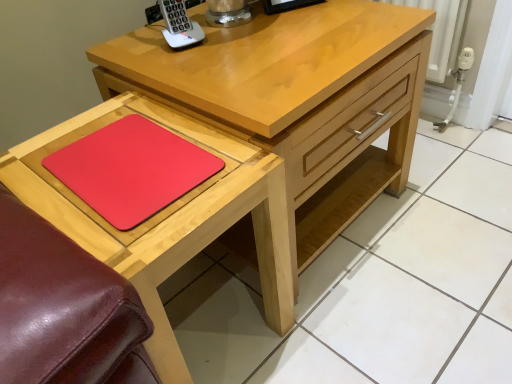
Question: Is rubberized red mousepad at lower left inside or outside of matte wood chest of drawers at center?

Choices:
 (A) inside
 (B) outside

Answer: (B)

Question: Considering the positions of rubberized red mousepad at lower left and matte wood chest of drawers at center in the image, is rubberized red mousepad at lower left wider or thinner than matte wood chest of drawers at center?

Choices:
 (A) wide
 (B) thin

Answer: (B)

Question: Which object is positioned closest to the matte wood chest of drawers at center?

Choices:
 (A) matte wooden table at lower left
 (B) rubberized red mousepad at lower left
 (C) white plastic phone at upper center

Answer: (A)

Question: Estimate the real-world distances between objects in this image. Which object is closer to the white plastic phone at upper center?

Choices:
 (A) rubberized red mousepad at lower left
 (B) matte wood chest of drawers at center
 (C) matte wooden table at lower left

Answer: (B)